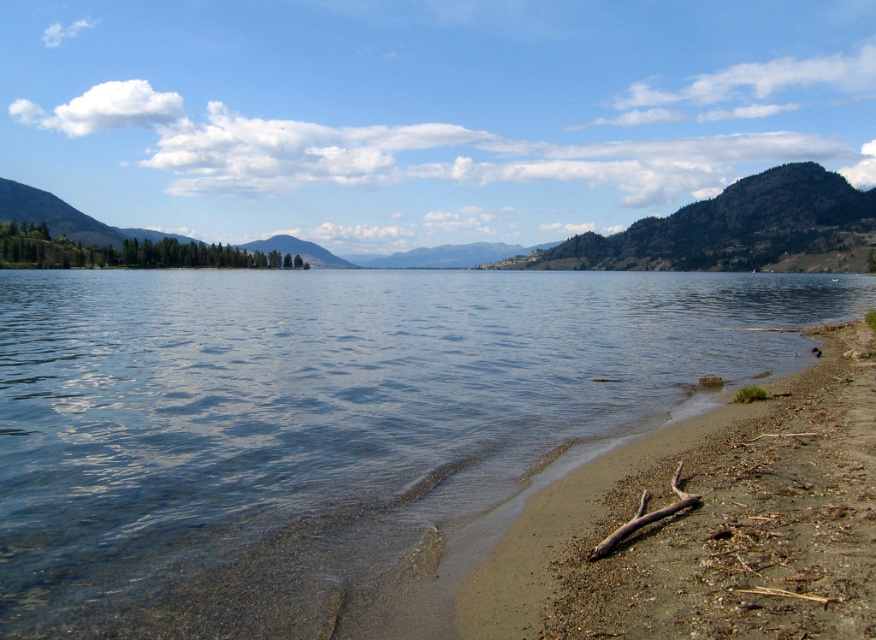
Question: Does clear water at shore left lie in front of brown sandy beach at lower right?

Choices:
 (A) yes
 (B) no

Answer: (B)

Question: Which point is closer to the camera?

Choices:
 (A) (636, 538)
 (B) (11, 576)

Answer: (B)

Question: Which point is closer to the camera?

Choices:
 (A) pos(290,403)
 (B) pos(845,588)

Answer: (B)

Question: Which point appears farthest from the camera in this image?

Choices:
 (A) (499, 330)
 (B) (816, 468)

Answer: (A)

Question: Can you confirm if clear water at shore left is bigger than brown sandy beach at lower right?

Choices:
 (A) yes
 (B) no

Answer: (A)

Question: Does clear water at shore left appear over brown sandy beach at lower right?

Choices:
 (A) no
 (B) yes

Answer: (B)